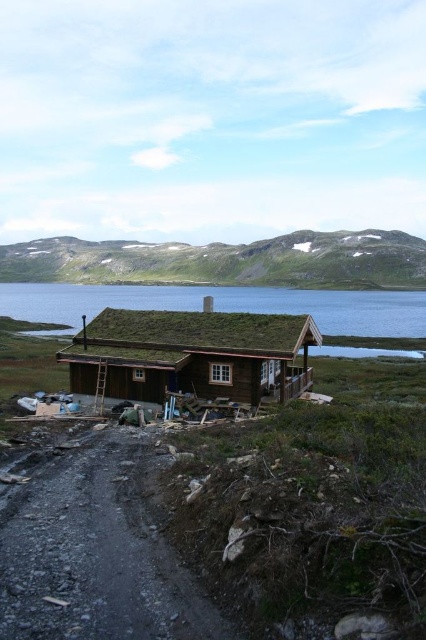
You are standing at the entrance of the brown wooden log cabin at center and want to walk to the dusty gravel path at lower left. Which direction should you head towards?

The dusty gravel path at lower left is positioned on the right side of the brown wooden log cabin at center, so you should head to the right to reach it.